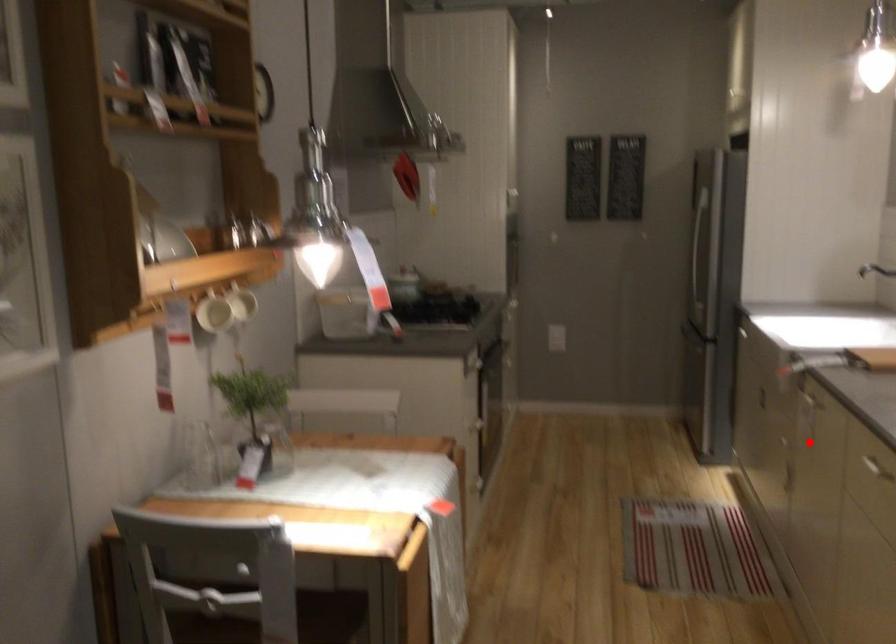
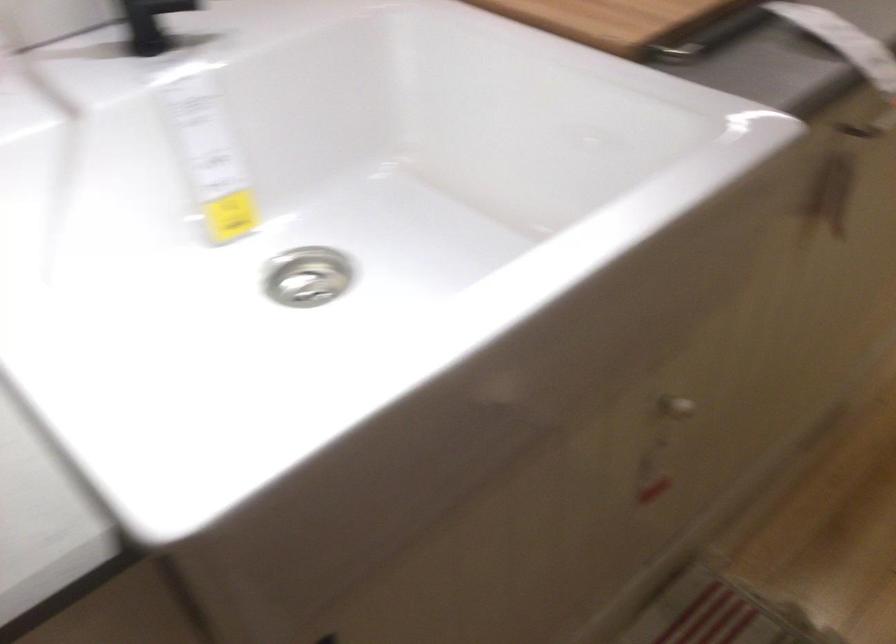
Question: I am providing you with two images of the same scene from different viewpoints. A red point is marked on the first image. Is the red point's position out of view in image 2?

Choices:
 (A) Yes
 (B) No

Answer: (B)